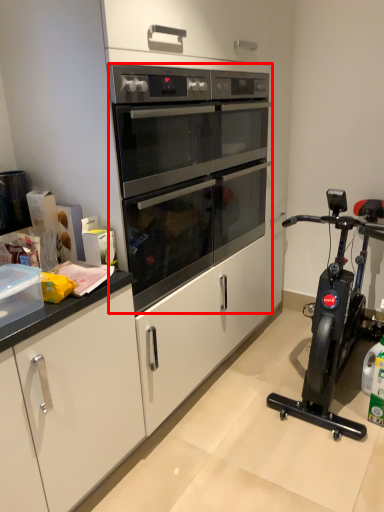
Question: Considering the relative positions of oven (annotated by the red box) and home appliance in the image provided, where is oven (annotated by the red box) located with respect to the staircase?

Choices:
 (A) right
 (B) left

Answer: (B)